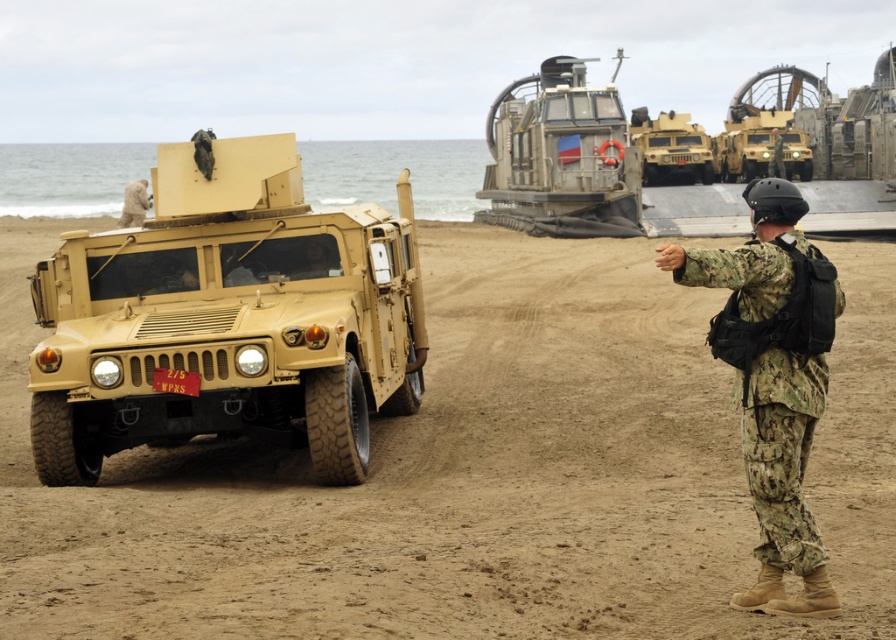
Does point (112, 273) come behind point (134, 204)?

No, it is in front of (134, 204).

Is matte tan vehicle at left to the left of white fur dog at left from the viewer's perspective?

In fact, matte tan vehicle at left is to the right of white fur dog at left.

The height and width of the screenshot is (640, 896). Describe the element at coordinates (227, 317) in the screenshot. I see `matte tan vehicle at left` at that location.

This screenshot has width=896, height=640. In order to click on matte tan vehicle at left in this screenshot , I will do `click(227, 317)`.

Is matte tan vehicle at left further to the viewer compared to camouflage uniform at center?

No, it is not.

Which is in front, point (388, 401) or point (774, 145)?

Positioned in front is point (388, 401).

You are a GUI agent. You are given a task and a screenshot of the screen. Output one action in this format:
    pyautogui.click(x=<x>, y=<y>)
    Task: Click on the matte tan vehicle at left
    The height and width of the screenshot is (640, 896).
    Given the screenshot: What is the action you would take?
    pyautogui.click(x=227, y=317)

Locate an element on the screen. The width and height of the screenshot is (896, 640). matte tan vehicle at left is located at coordinates (227, 317).

Is white fur dog at left to the right of camouflage uniform at center from the viewer's perspective?

Incorrect, white fur dog at left is not on the right side of camouflage uniform at center.

Is white fur dog at left wider than camouflage uniform at center?

Correct, the width of white fur dog at left exceeds that of camouflage uniform at center.

Measure the distance between point (x=145, y=204) and camera.

The distance of point (x=145, y=204) from camera is 25.01 meters.

Image resolution: width=896 pixels, height=640 pixels. I want to click on white fur dog at left, so click(134, 204).